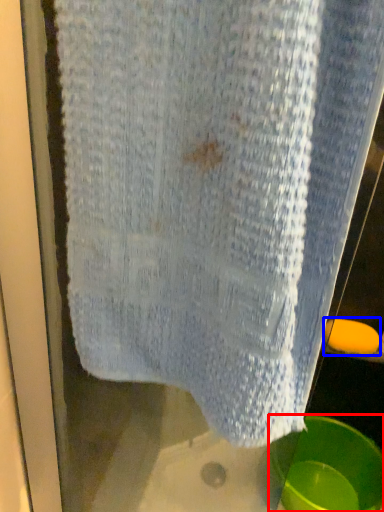
Question: Which of the following is the closest to the observer, basin (highlighted by a red box) or soap (highlighted by a blue box)?

Choices:
 (A) basin
 (B) soap

Answer: (A)